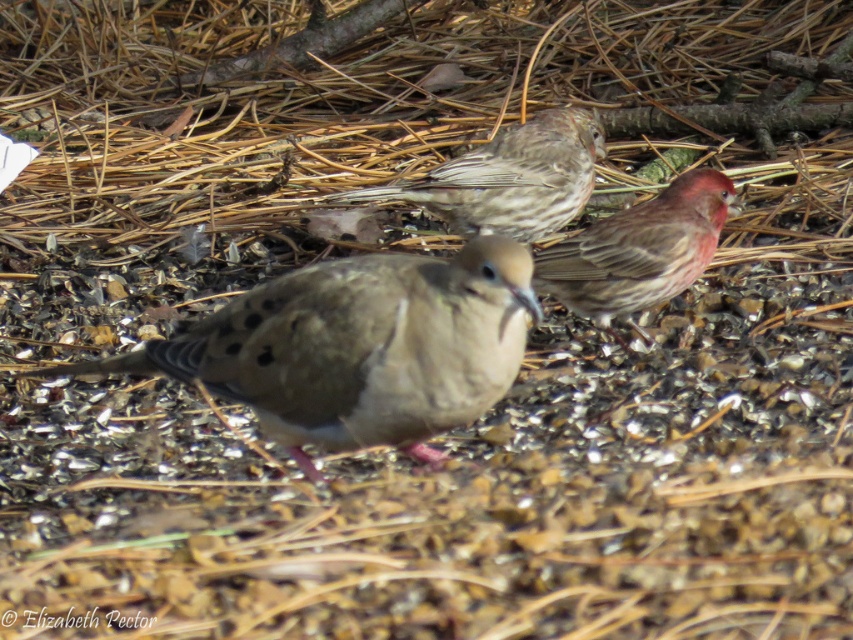
Question: Which object is farther from the camera taking this photo?

Choices:
 (A) brown speckled sparrow at right
 (B) brown speckled sparrow at upper center
 (C) brown speckled pigeon at center

Answer: (B)

Question: Which point is closer to the camera taking this photo?

Choices:
 (A) (523, 204)
 (B) (300, 296)
 (C) (706, 196)

Answer: (B)

Question: Can you confirm if brown speckled sparrow at right is wider than brown speckled sparrow at upper center?

Choices:
 (A) no
 (B) yes

Answer: (A)

Question: Is brown speckled pigeon at center thinner than brown speckled sparrow at right?

Choices:
 (A) no
 (B) yes

Answer: (A)

Question: Considering the relative positions of brown speckled sparrow at right and brown speckled sparrow at upper center in the image provided, where is brown speckled sparrow at right located with respect to brown speckled sparrow at upper center?

Choices:
 (A) right
 (B) left

Answer: (A)

Question: Among these objects, which one is farthest from the camera?

Choices:
 (A) brown speckled pigeon at center
 (B) brown speckled sparrow at upper center

Answer: (B)